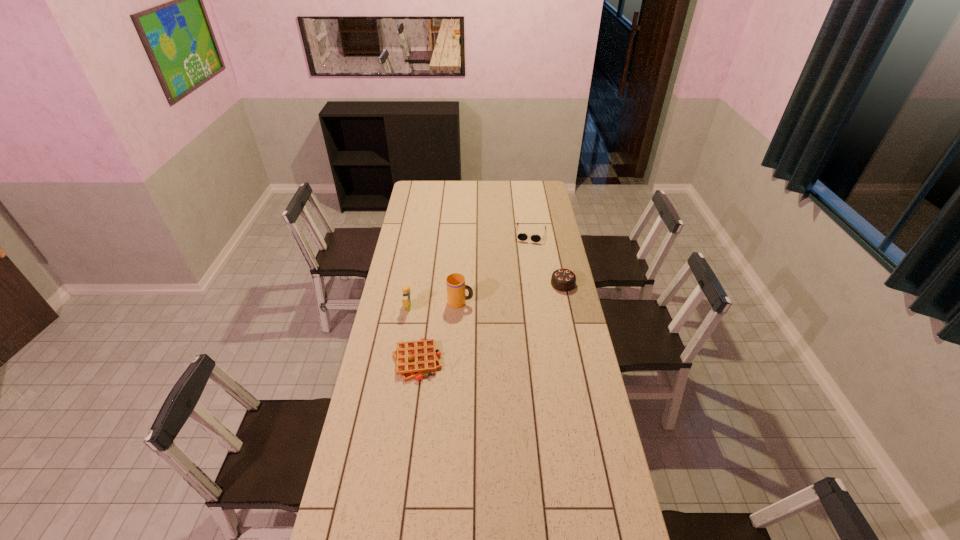
Image resolution: width=960 pixels, height=540 pixels. I want to click on vacant region located 0.100m on the left of the chocolate cake, so click(530, 284).

Find the location of `free spot located 0.390m on the side of the tallest object with the handle`. free spot located 0.390m on the side of the tallest object with the handle is located at coordinates (557, 314).

The height and width of the screenshot is (540, 960). Find the location of `vacant position located 0.250m on the side of the tallest object with the handle`. vacant position located 0.250m on the side of the tallest object with the handle is located at coordinates (526, 310).

Find the location of a particular element. The image size is (960, 540). free location located 0.290m on the side of the tallest object with the handle is located at coordinates (535, 311).

What are the coordinates of `free space located 0.190m on the front-facing side of the farthest object` in the screenshot? It's located at (525, 265).

Locate an element on the screen. free space located on the front-facing side of the farthest object is located at coordinates (520, 291).

The image size is (960, 540). I want to click on free space located 0.260m on the front-facing side of the farthest object, so [523, 274].

This screenshot has width=960, height=540. I want to click on vacant space located 0.350m on the face of the second tallest object, so click(x=487, y=307).

Find the location of a particular element. The width and height of the screenshot is (960, 540). free space located on the face of the second tallest object is located at coordinates [x=428, y=307].

I want to click on vacant space located 0.160m on the face of the second tallest object, so click(x=445, y=307).